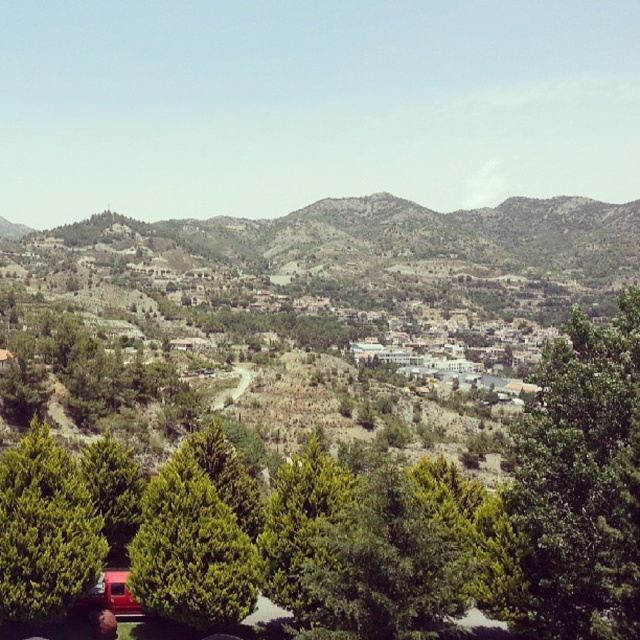
Which is in front, point (518, 577) or point (10, 529)?

Point (10, 529) is more forward.

Is green leafy tree at center bigger than green textured tree at lower left?

Yes.

Where is `green leafy tree at center`? This screenshot has height=640, width=640. green leafy tree at center is located at coordinates (579, 486).

Which is behind, point (220, 284) or point (570, 336)?

Positioned behind is point (220, 284).

This screenshot has height=640, width=640. Describe the element at coordinates (300, 307) in the screenshot. I see `green textured hillside at center` at that location.

Which is in front, point (99, 419) or point (618, 323)?

Point (618, 323)

This screenshot has width=640, height=640. I want to click on green textured hillside at center, so click(300, 307).

Is green leafy tree at center above green leafy tree at lower left?

Correct, green leafy tree at center is located above green leafy tree at lower left.

Between green leafy tree at center and green leafy tree at lower left, which one has more height?

Standing taller between the two is green leafy tree at center.

This screenshot has width=640, height=640. What do you see at coordinates (579, 486) in the screenshot?
I see `green leafy tree at center` at bounding box center [579, 486].

The image size is (640, 640). Identify the location of green leafy tree at center. (579, 486).